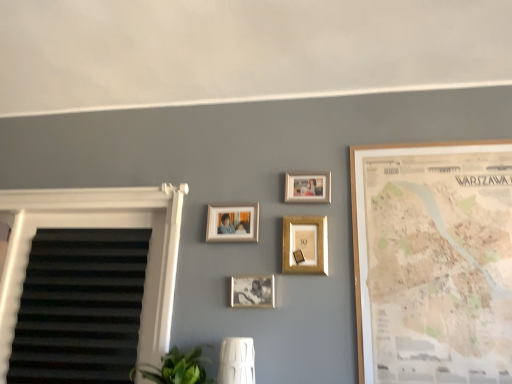
Question: Is white textured blind at left placed right next to gold metallic picture frame at center, marked as the third picture frame in a right-to-left arrangement?

Choices:
 (A) yes
 (B) no

Answer: (B)

Question: Is white textured blind at left bigger than gold metallic picture frame at center, positioned as the 3th picture frame in left-to-right order?

Choices:
 (A) no
 (B) yes

Answer: (B)

Question: Does white textured blind at left have a greater height compared to gold metallic picture frame at center, marked as the third picture frame in a right-to-left arrangement?

Choices:
 (A) yes
 (B) no

Answer: (A)

Question: Considering the relative sizes of white textured blind at left and gold metallic picture frame at center, marked as the third picture frame in a right-to-left arrangement, in the image provided, is white textured blind at left shorter than gold metallic picture frame at center, marked as the third picture frame in a right-to-left arrangement,?

Choices:
 (A) yes
 (B) no

Answer: (B)

Question: From a real-world perspective, is white textured blind at left under gold metallic picture frame at center, marked as the third picture frame in a right-to-left arrangement?

Choices:
 (A) yes
 (B) no

Answer: (A)

Question: Is white textured blind at left turned away from gold metallic picture frame at center, positioned as the 3th picture frame in left-to-right order?

Choices:
 (A) yes
 (B) no

Answer: (B)

Question: Does wooden map at right, positioned as the 1th picture frame in right-to-left order, have a larger size compared to metallic silver photo frame at center, arranged as the fourth picture frame when viewed from the right?

Choices:
 (A) yes
 (B) no

Answer: (A)

Question: Is wooden map at right, positioned as the 1th picture frame in right-to-left order, not close to metallic silver photo frame at center, which is the 2th picture frame in left-to-right order?

Choices:
 (A) yes
 (B) no

Answer: (B)

Question: Does wooden map at right, positioned as the 1th picture frame in right-to-left order, come in front of metallic silver photo frame at center, which is the 2th picture frame in left-to-right order?

Choices:
 (A) yes
 (B) no

Answer: (A)

Question: Is wooden map at right, positioned as the 1th picture frame in right-to-left order, aimed at metallic silver photo frame at center, which is the 2th picture frame in left-to-right order?

Choices:
 (A) no
 (B) yes

Answer: (A)

Question: Is wooden map at right, positioned as the 1th picture frame in right-to-left order, shorter than metallic silver photo frame at center, arranged as the fourth picture frame when viewed from the right?

Choices:
 (A) yes
 (B) no

Answer: (B)

Question: From a real-world perspective, is wooden map at right, acting as the 5th picture frame starting from the left, on top of metallic silver photo frame at center, arranged as the fourth picture frame when viewed from the right?

Choices:
 (A) no
 (B) yes

Answer: (B)

Question: Does gold metallic picture frame at center, positioned as the 3th picture frame in left-to-right order, contain wooden map at right, positioned as the 1th picture frame in right-to-left order?

Choices:
 (A) no
 (B) yes

Answer: (A)